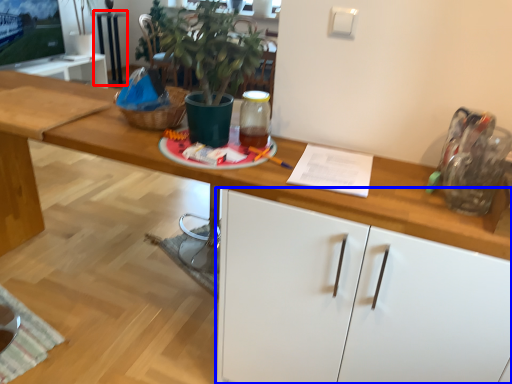
Question: Which of the following is the farthest to the observer, table (highlighted by a red box) or cabinetry (highlighted by a blue box)?

Choices:
 (A) table
 (B) cabinetry

Answer: (A)